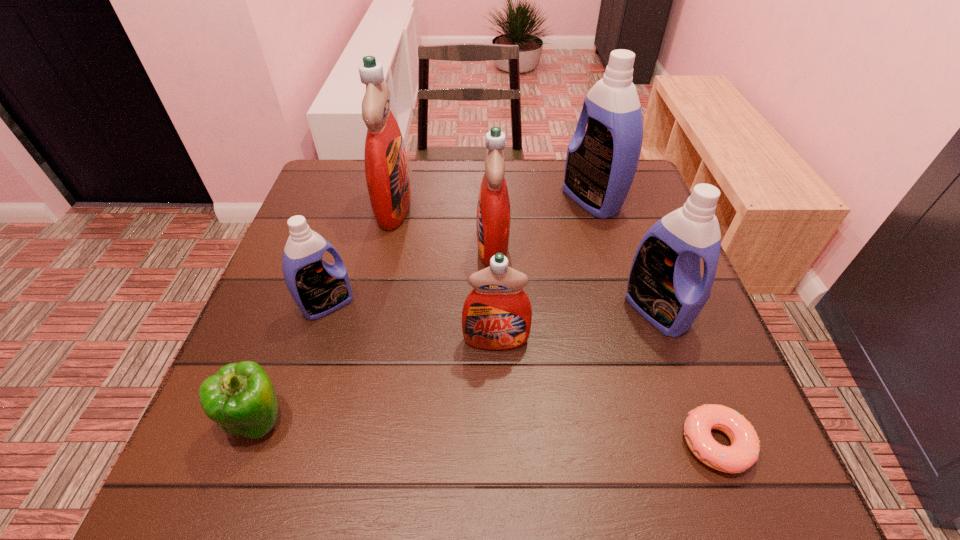
Locate an element on the screen. free space at the left edge of the desktop is located at coordinates (329, 232).

The width and height of the screenshot is (960, 540). What are the coordinates of `free location at the right edge of the desktop` in the screenshot? It's located at tap(730, 372).

Image resolution: width=960 pixels, height=540 pixels. I want to click on vacant space at the far right corner of the desktop, so click(636, 173).

Where is `free point between the second biggest blue detergent and the second smallest red detergent`? This screenshot has width=960, height=540. free point between the second biggest blue detergent and the second smallest red detergent is located at coordinates (574, 278).

Locate an element on the screen. vacant area that lies between the smallest blue detergent and the biggest blue detergent is located at coordinates coord(459,252).

Locate an element on the screen. This screenshot has width=960, height=540. vacant area between the smallest blue detergent and the shortest object is located at coordinates (521, 374).

Find the location of `free space between the leftmost blue detergent and the shortest object`. free space between the leftmost blue detergent and the shortest object is located at coordinates (521, 374).

Image resolution: width=960 pixels, height=540 pixels. In order to click on free space between the second smallest blue detergent and the seventh tallest object in this screenshot , I will do `click(457, 364)`.

The width and height of the screenshot is (960, 540). In order to click on vacant region between the second smallest red detergent and the biggest red detergent in this screenshot , I will do `click(444, 227)`.

Find the location of a particular element. This screenshot has height=540, width=960. free space between the smallest blue detergent and the second biggest red detergent is located at coordinates (410, 275).